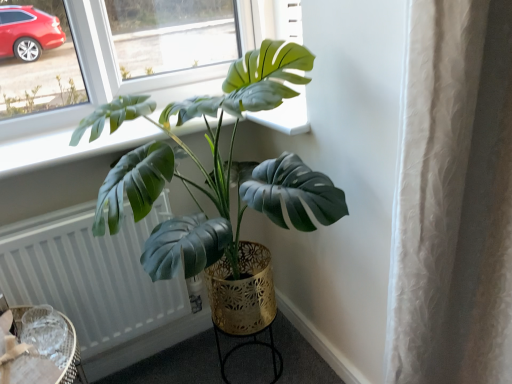
Question: Does green matte plant at center lie in front of gold metallic round table at lower center, arranged as the first round table when viewed from the right?

Choices:
 (A) yes
 (B) no

Answer: (A)

Question: Is gold metallic round table at lower center, arranged as the first round table when viewed from the right, at the back of green matte plant at center?

Choices:
 (A) yes
 (B) no

Answer: (B)

Question: Is green matte plant at center positioned beyond the bounds of gold metallic round table at lower center, marked as the first round table in a back-to-front arrangement?

Choices:
 (A) no
 (B) yes

Answer: (B)

Question: From a real-world perspective, is green matte plant at center physically above gold metallic round table at lower center, which is counted as the second round table, starting from the front?

Choices:
 (A) no
 (B) yes

Answer: (B)

Question: Is gold metallic round table at lower center, marked as the first round table in a back-to-front arrangement, a part of green matte plant at center?

Choices:
 (A) no
 (B) yes

Answer: (A)

Question: Considering the positions of white textured radiator at lower left and green matte plant at center in the image, is white textured radiator at lower left wider or thinner than green matte plant at center?

Choices:
 (A) thin
 (B) wide

Answer: (A)

Question: In terms of height, does white textured radiator at lower left look taller or shorter compared to green matte plant at center?

Choices:
 (A) short
 (B) tall

Answer: (A)

Question: Considering their positions, is white textured radiator at lower left located in front of or behind green matte plant at center?

Choices:
 (A) front
 (B) behind

Answer: (B)

Question: Which is correct: white textured radiator at lower left is inside green matte plant at center, or outside of it?

Choices:
 (A) inside
 (B) outside

Answer: (A)

Question: Is woven rattan table at lower left, acting as the second round table starting from the right, wider or thinner than green matte plant at center?

Choices:
 (A) wide
 (B) thin

Answer: (B)

Question: From the image's perspective, is woven rattan table at lower left, placed as the 2th round table when sorted from back to front, located above or below green matte plant at center?

Choices:
 (A) above
 (B) below

Answer: (B)

Question: Is woven rattan table at lower left, acting as the second round table starting from the right, taller or shorter than green matte plant at center?

Choices:
 (A) tall
 (B) short

Answer: (B)

Question: Is woven rattan table at lower left, which is counted as the first round table, starting from the front, in front of or behind green matte plant at center in the image?

Choices:
 (A) behind
 (B) front

Answer: (A)

Question: Is gold metallic round table at lower center, which is counted as the second round table, starting from the front, taller or shorter than white textured radiator at lower left?

Choices:
 (A) tall
 (B) short

Answer: (B)

Question: In the image, is gold metallic round table at lower center, which is counted as the second round table, starting from the front, on the left side or the right side of white textured radiator at lower left?

Choices:
 (A) left
 (B) right

Answer: (B)